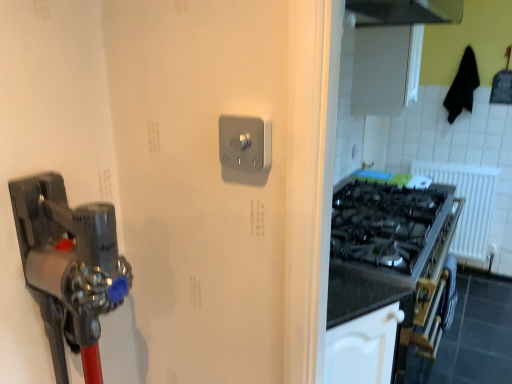
The height and width of the screenshot is (384, 512). I want to click on white plastic radiator at right, so click(468, 205).

Describe the element at coordinates (468, 205) in the screenshot. This screenshot has height=384, width=512. I see `white plastic radiator at right` at that location.

What do you see at coordinates (245, 142) in the screenshot? I see `satin silver switch at center` at bounding box center [245, 142].

You are a GUI agent. You are given a task and a screenshot of the screen. Output one action in this format:
    pyautogui.click(x=<x>, y=<y>)
    Task: Click on the satin silver switch at center
    This screenshot has width=512, height=384.
    Given the screenshot: What is the action you would take?
    pyautogui.click(x=245, y=142)

The width and height of the screenshot is (512, 384). In order to click on white plastic radiator at right in this screenshot , I will do `click(468, 205)`.

Is white plastic radiator at right to the left or to the right of satin silver switch at center in the image?

white plastic radiator at right is positioned on satin silver switch at center's right side.

Is the position of white plastic radiator at right more distant than that of satin silver switch at center?

Yes, white plastic radiator at right is further from the viewer.

Is point (485, 199) positioned in front of point (239, 139)?

No, (485, 199) is behind (239, 139).

From the image's perspective, is white plastic radiator at right under satin silver switch at center?

Indeed, from the image's perspective, white plastic radiator at right is shown beneath satin silver switch at center.

From a real-world perspective, is white plastic radiator at right below satin silver switch at center?

Yes, from a real-world perspective, white plastic radiator at right is under satin silver switch at center.

Can you confirm if white plastic radiator at right is wider than satin silver switch at center?

Yes.

Considering the sizes of white plastic radiator at right and satin silver switch at center in the image, is white plastic radiator at right taller or shorter than satin silver switch at center?

In the image, white plastic radiator at right appears to be taller than satin silver switch at center.

Is white plastic radiator at right bigger than satin silver switch at center?

Indeed, white plastic radiator at right has a larger size compared to satin silver switch at center.

Is white plastic radiator at right not within satin silver switch at center?

Answer: That's correct, white plastic radiator at right is outside of satin silver switch at center.

Is white plastic radiator at right next to satin silver switch at center and touching it?

There is a gap between white plastic radiator at right and satin silver switch at center.

Could you tell me if white plastic radiator at right is turned towards satin silver switch at center?

Yes, white plastic radiator at right is oriented towards satin silver switch at center.

How different are the orientations of white plastic radiator at right and satin silver switch at center in degrees?

There is a 0.468-degree angle between the facing directions of white plastic radiator at right and satin silver switch at center.

Image resolution: width=512 pixels, height=384 pixels. What are the coordinates of `radiator behind the satin silver switch at center` in the screenshot? It's located at (468, 205).

Visually, is satin silver switch at center positioned to the left or to the right of white plastic radiator at right?

satin silver switch at center is positioned on white plastic radiator at right's left side.

Is the position of satin silver switch at center more distant than that of white plastic radiator at right?

No, it is in front of white plastic radiator at right.

Is point (226, 153) positioned after point (496, 175)?

No, (226, 153) is in front of (496, 175).

From the image's perspective, which is below, satin silver switch at center or white plastic radiator at right?

white plastic radiator at right appears lower in the image.

From a real-world perspective, is satin silver switch at center positioned above or below white plastic radiator at right?

satin silver switch at center is situated higher than white plastic radiator at right in the real world.

Does satin silver switch at center have a greater width compared to white plastic radiator at right?

No, satin silver switch at center is not wider than white plastic radiator at right.

Between satin silver switch at center and white plastic radiator at right, which one has less height?

satin silver switch at center is shorter.

Which of these two, satin silver switch at center or white plastic radiator at right, is smaller?

With smaller size is satin silver switch at center.

Does satin silver switch at center contain white plastic radiator at right?

No, white plastic radiator at right is not inside satin silver switch at center.

Is satin silver switch at center far from white plastic radiator at right?

Yes, satin silver switch at center and white plastic radiator at right are located far from each other.

Could you tell me if satin silver switch at center is turned towards white plastic radiator at right?

No.

Looking at this image, how different are the orientations of satin silver switch at center and white plastic radiator at right in degrees?

The angular difference between satin silver switch at center and white plastic radiator at right is 0.468 degrees.

Find the location of a particular element. light switch that is on the left side of white plastic radiator at right is located at coordinates (245, 142).

The width and height of the screenshot is (512, 384). Identify the location of radiator that is below the satin silver switch at center (from the image's perspective). coord(468,205).

Locate an element on the screen. light switch lying on the left of white plastic radiator at right is located at coordinates (245, 142).